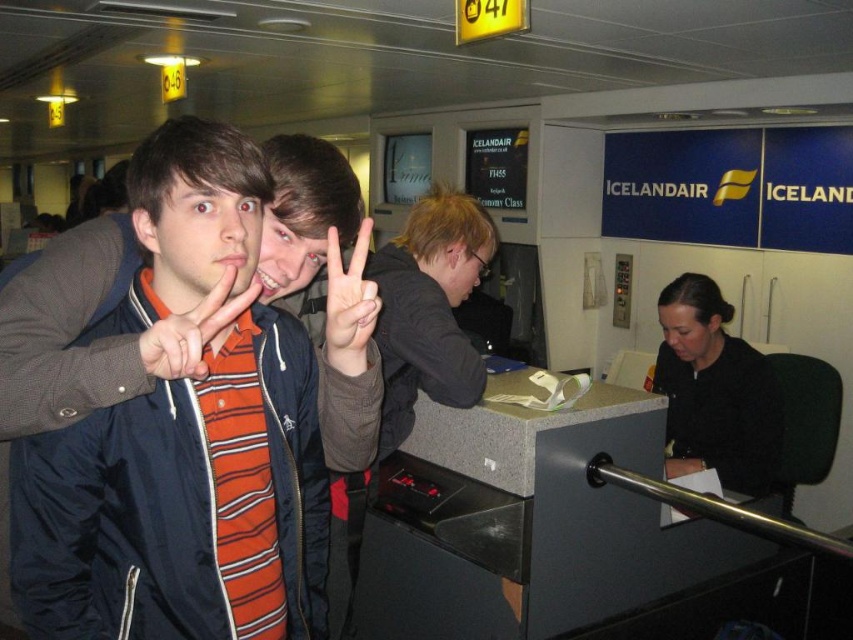
Does matte blue jacket at center have a greater width compared to matte orange striped shirt at center?

Correct, the width of matte blue jacket at center exceeds that of matte orange striped shirt at center.

Who is higher up, matte blue jacket at center or matte orange striped shirt at center?

Positioned higher is matte orange striped shirt at center.

Identify the location of matte blue jacket at center. The width and height of the screenshot is (853, 640). (181, 502).

Can you confirm if matte orange shirt at center is positioned to the left of matte orange striped shirt at center?

Correct, you'll find matte orange shirt at center to the left of matte orange striped shirt at center.

Who is higher up, matte orange shirt at center or matte orange striped shirt at center?

matte orange striped shirt at center is higher up.

Between point (160, 352) and point (334, 284), which one is positioned in front?

Point (160, 352) is more forward.

The height and width of the screenshot is (640, 853). Identify the location of matte orange shirt at center. (190, 328).

Is matte blue jacket at center to the right of matte orange shirt at center from the viewer's perspective?

Indeed, matte blue jacket at center is positioned on the right side of matte orange shirt at center.

Does point (315, 548) come behind point (178, 349)?

Yes.

The height and width of the screenshot is (640, 853). Find the location of `matte blue jacket at center`. matte blue jacket at center is located at coordinates (181, 502).